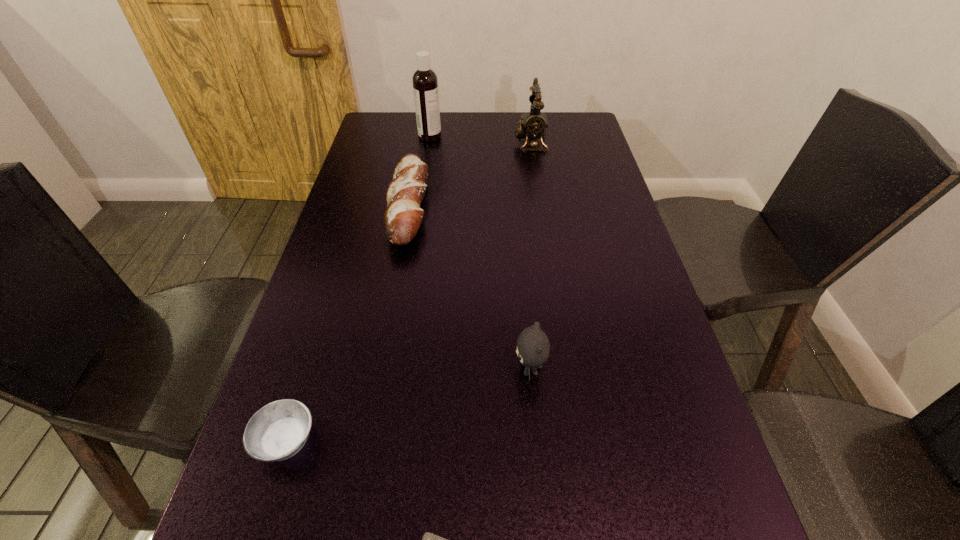
Where is `the tallest object`? This screenshot has height=540, width=960. the tallest object is located at coordinates (425, 83).

I want to click on the fifth shortest object, so click(x=533, y=125).

Find the location of a particular element. Image resolution: width=960 pixels, height=540 pixels. the third tallest object is located at coordinates point(533,347).

Find the location of `kitten`. kitten is located at coordinates (533, 347).

At what (x,y) coordinates should I click in order to perform the action: click on the third farthest object. Please return your answer as a coordinate pair (x, y). Looking at the image, I should click on (403, 216).

Find the location of a particular element. This screenshot has width=960, height=540. baguet is located at coordinates (403, 216).

The image size is (960, 540). Find the location of `ashtray`. ashtray is located at coordinates (279, 430).

I want to click on the second shortest object, so click(x=279, y=430).

You are a GUI agent. You are given a task and a screenshot of the screen. Output one action in this format:
    pyautogui.click(x=<x>, y=<y>)
    Task: Click on the vacant space situated 0.190m on the label side of the tallest object
    
    Given the screenshot: What is the action you would take?
    pyautogui.click(x=497, y=137)

Identify the location of vacant space located on the rotary dial of the fifth shortest object. (443, 143).